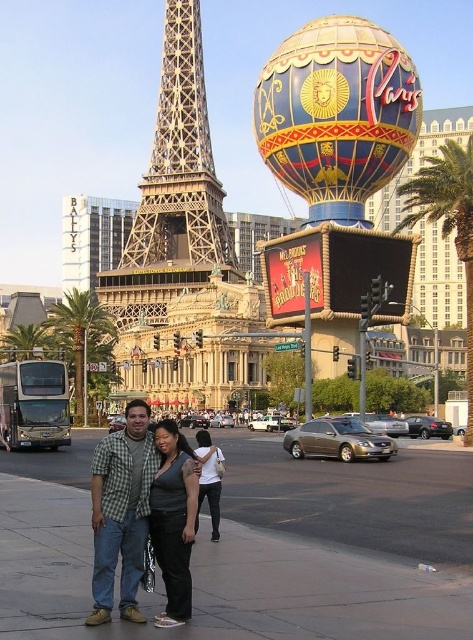
Which is more to the right, smooth asphalt pavement at center or green leafy palm tree at center?

From the viewer's perspective, smooth asphalt pavement at center appears more on the right side.

Can you confirm if smooth asphalt pavement at center is thinner than green leafy palm tree at center?

Incorrect, smooth asphalt pavement at center's width is not less than green leafy palm tree at center's.

This screenshot has height=640, width=473. What are the coordinates of `smooth asphalt pavement at center` in the screenshot? It's located at (330, 548).

Which of these two, smooth asphalt pavement at center or dark gray fabric shirt at center, stands shorter?

With less height is smooth asphalt pavement at center.

Based on the photo, measure the distance between point (265, 552) and camera.

A distance of 37.05 meters exists between point (265, 552) and camera.

Between point (51, 621) and point (172, 468), which one is positioned in front?

Point (51, 621) is in front.

I want to click on smooth asphalt pavement at center, so click(x=330, y=548).

Can you confirm if blue glossy balloon at upper center is positioned above green leafy palm tree at center?

Indeed, blue glossy balloon at upper center is positioned over green leafy palm tree at center.

Is point (395, 116) positioned behind point (92, 308)?

No.

Who is more distant from viewer, (336,102) or (71,310)?

The point (71,310) is behind.

Locate an element on the screen. blue glossy balloon at upper center is located at coordinates (336, 113).